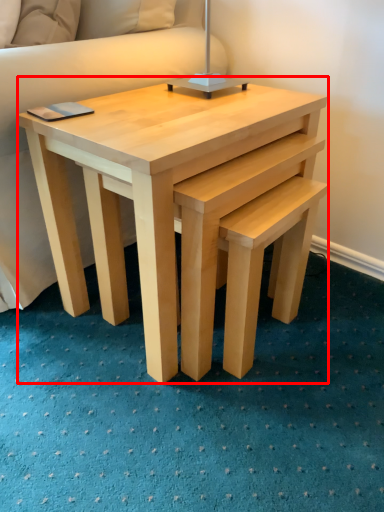
Question: From the image's perspective, where is coffee table (annotated by the red box) located in relation to table lamp in the image?

Choices:
 (A) above
 (B) below

Answer: (B)